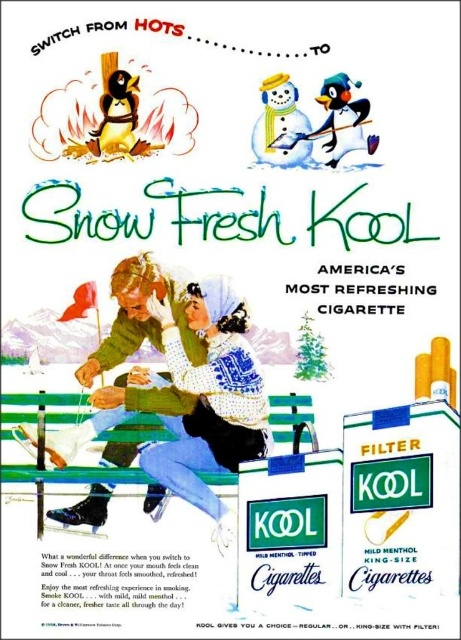
Is green knitted sweater at center below white paper snowman at upper center?

Yes.

Who is taller, green knitted sweater at center or white paper snowman at upper center?

green knitted sweater at center is taller.

Which is in front, point (65, 509) or point (372, 134)?

Positioned in front is point (65, 509).

The image size is (461, 640). Identify the location of green knitted sweater at center. (135, 317).

Is point (188, 330) behind point (307, 141)?

No, it is in front of (307, 141).

Is green knitted sweater at center smaller than white matte snowman at upper center?

Actually, green knitted sweater at center might be larger than white matte snowman at upper center.

The width and height of the screenshot is (461, 640). In order to click on green knitted sweater at center in this screenshot , I will do `click(135, 317)`.

Consider the image. Is green wooden bench at center wider than white matte snowman at upper center?

Incorrect, green wooden bench at center's width does not surpass white matte snowman at upper center's.

Does green wooden bench at center have a smaller size compared to white matte snowman at upper center?

Correct, green wooden bench at center occupies less space than white matte snowman at upper center.

Is point (118, 432) closer to viewer compared to point (277, 148)?

Yes, it is.

Image resolution: width=461 pixels, height=640 pixels. Find the location of `green wooden bench at center`. green wooden bench at center is located at coordinates (75, 476).